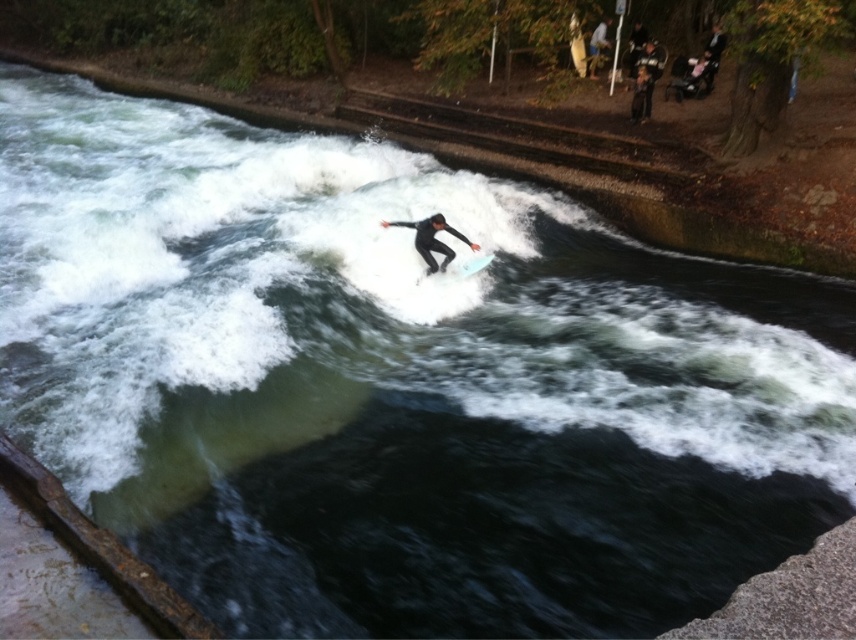
Question: Among these objects, which one is farthest from the camera?

Choices:
 (A) black wetsuit surfer at center
 (B) light blue smooth surfboard at center

Answer: (B)

Question: Which object is positioned farthest from the black wetsuit surfer at center?

Choices:
 (A) white foam surfboard at center
 (B) light blue smooth surfboard at center

Answer: (B)

Question: Is white foam surfboard at center wider than light blue smooth surfboard at center?

Choices:
 (A) yes
 (B) no

Answer: (B)

Question: Which object is farther from the camera taking this photo?

Choices:
 (A) white foam surfboard at center
 (B) black wetsuit surfer at center
 (C) light blue smooth surfboard at center

Answer: (A)

Question: Does black wetsuit surfer at center have a smaller size compared to white foam surfboard at center?

Choices:
 (A) yes
 (B) no

Answer: (B)

Question: Can you confirm if black wetsuit surfer at center is smaller than white foam surfboard at center?

Choices:
 (A) yes
 (B) no

Answer: (B)